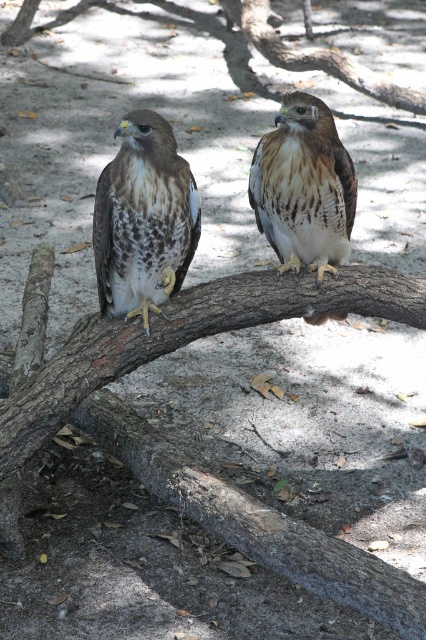
You are an ornithologist observing two hawks in the image. You notice both have brown speckled feathers at left and brown speckled feathers at center. Which set of feathers takes up more space in the image?

The brown speckled feathers at center take up more space than the brown speckled feathers at left.

You are a birdwatcher observing two hawks in the image. You notice both have brown speckled feathers at left and brown speckled feathers at center. Which set of feathers is taller?

The brown speckled feathers at center are taller than the brown speckled feathers at left according to the description.